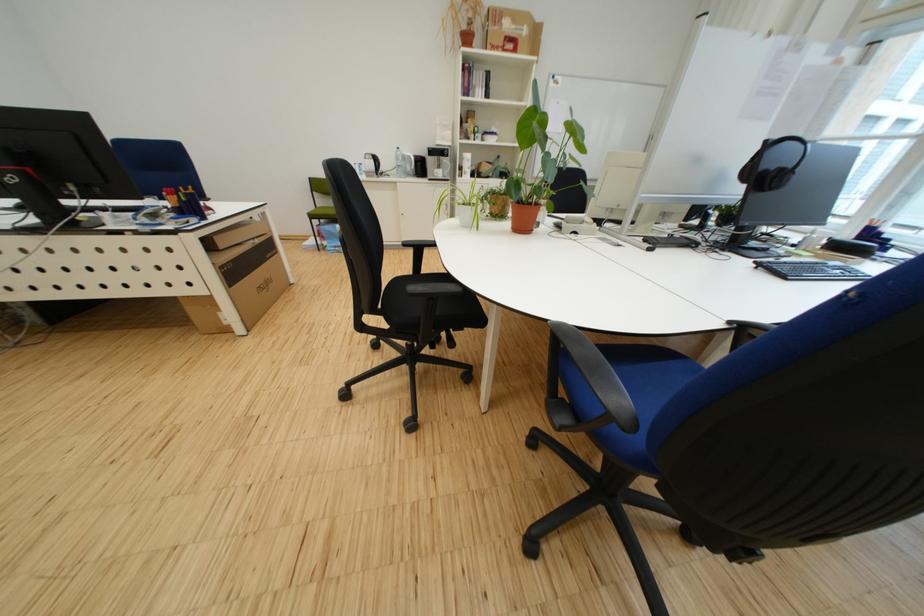
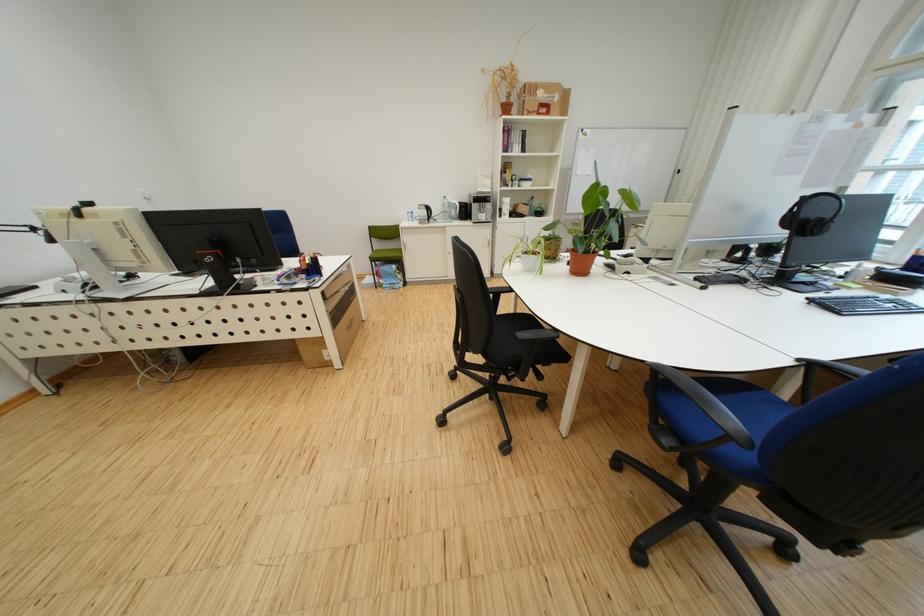
Find the pixel in the second image that matches pixel 786 140 in the first image.

(821, 196)